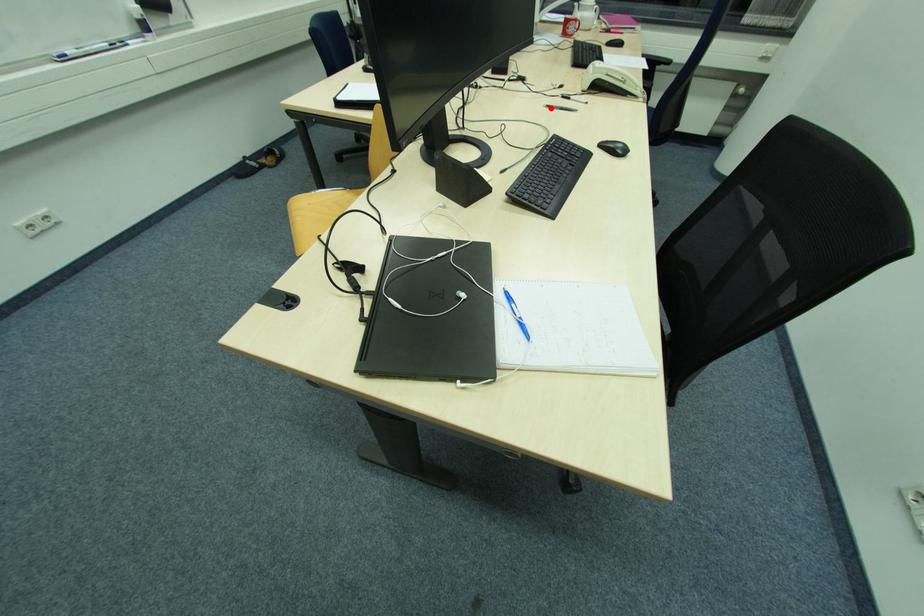
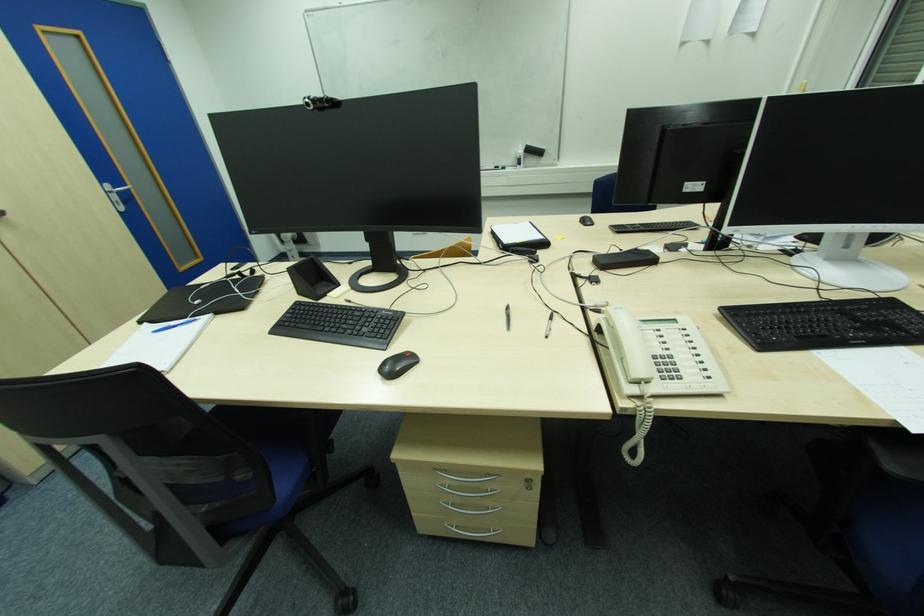
The point at the highlighted location is marked in the first image. Where is the corresponding point in the second image?

(509, 309)